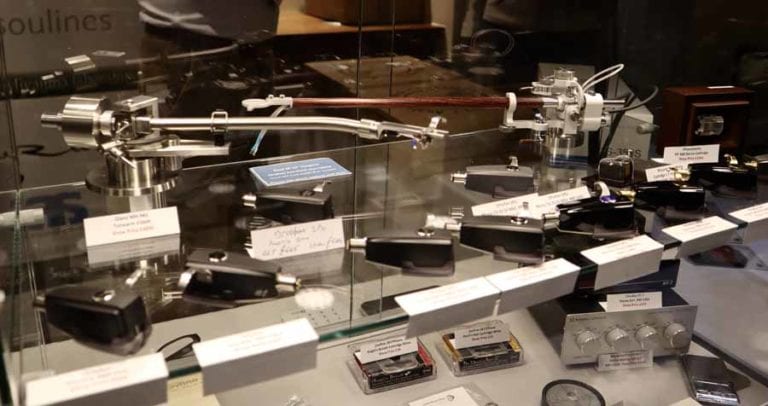
The height and width of the screenshot is (406, 768). What are the coordinates of `glass panels` in the screenshot? It's located at (30, 350), (190, 321), (468, 257).